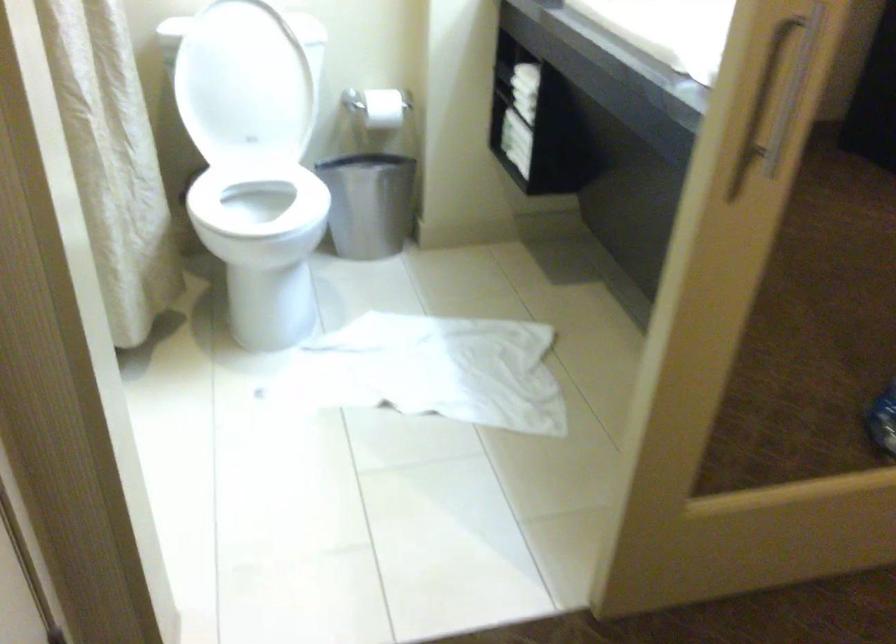
The height and width of the screenshot is (644, 896). What do you see at coordinates (231, 15) in the screenshot?
I see `a white toilet lid` at bounding box center [231, 15].